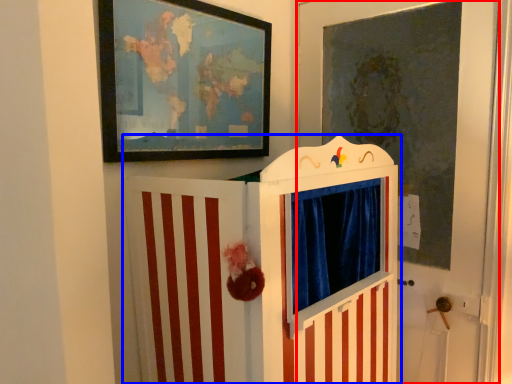
Question: Which object appears closest to the camera in this image, door (highlighted by a red box) or furniture (highlighted by a blue box)?

Choices:
 (A) door
 (B) furniture

Answer: (B)